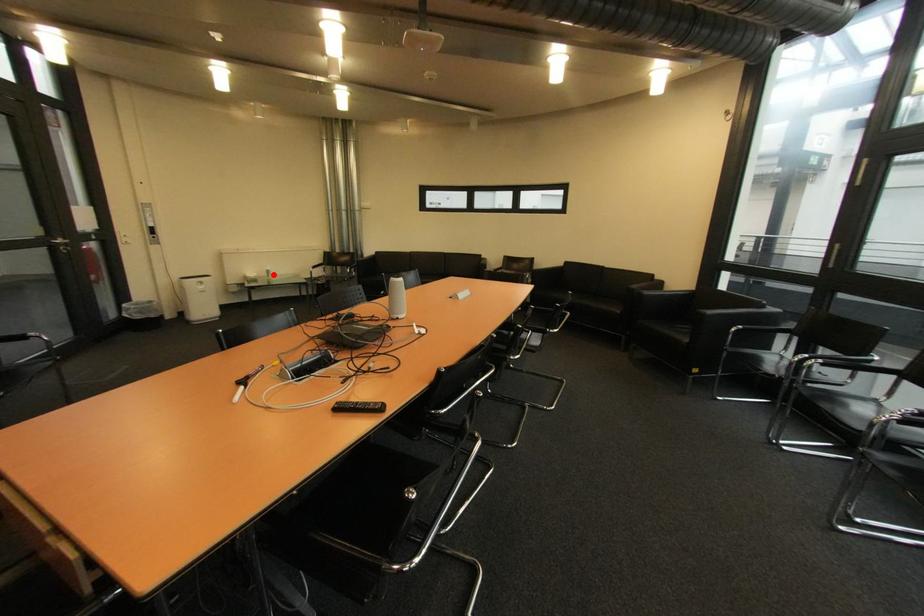
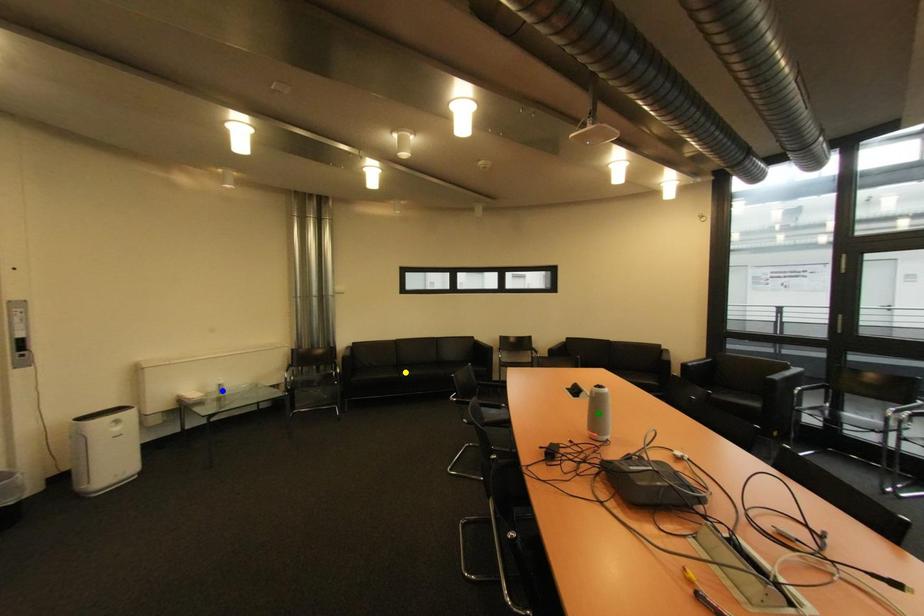
Question: I am providing you with two images of the same scene from different viewpoints. A red point is marked on the first image. You are given multiple points on the second image. Which point in image 2 is actually the same real-world point as the red point in image 1?

Choices:
 (A) green point
 (B) yellow point
 (C) blue point

Answer: (C)